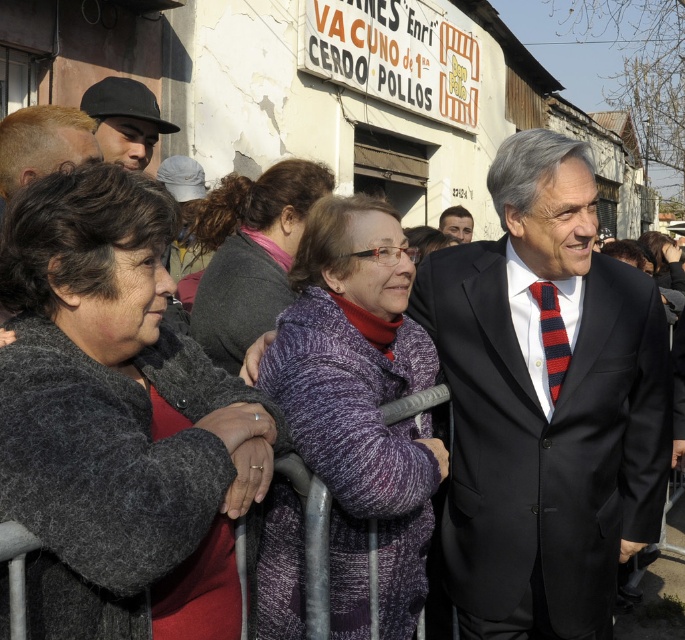
How distant is dark gray wool sweater at left from dark gray sweater at center?

dark gray wool sweater at left and dark gray sweater at center are 5.87 feet apart from each other.

Is the position of dark gray wool sweater at left less distant than that of dark gray sweater at center?

Yes, it is.

You are a GUI agent. You are given a task and a screenshot of the screen. Output one action in this format:
    pyautogui.click(x=<x>, y=<y>)
    Task: Click on the dark gray wool sweater at left
    The height and width of the screenshot is (640, 685).
    Given the screenshot: What is the action you would take?
    (x=116, y=419)

Looking at this image, measure the distance between purple knitted sweater at center and camera.

A distance of 8.69 feet exists between purple knitted sweater at center and camera.

Who is higher up, purple knitted sweater at center or dark gray sweater at center?

dark gray sweater at center is above.

Is point (299, 408) positioned in front of point (208, 243)?

Yes, point (299, 408) is closer to viewer.

This screenshot has width=685, height=640. Identify the location of purple knitted sweater at center. (360, 404).

Does dark gray wool sweater at left appear on the right side of black matte hat at upper left?

Indeed, dark gray wool sweater at left is positioned on the right side of black matte hat at upper left.

In order to click on dark gray wool sweater at left in this screenshot , I will do `click(116, 419)`.

This screenshot has width=685, height=640. I want to click on dark gray wool sweater at left, so click(116, 419).

You are a GUI agent. You are given a task and a screenshot of the screen. Output one action in this format:
    pyautogui.click(x=<x>, y=<y>)
    Task: Click on the dark gray wool sweater at left
    
    Given the screenshot: What is the action you would take?
    pyautogui.click(x=116, y=419)